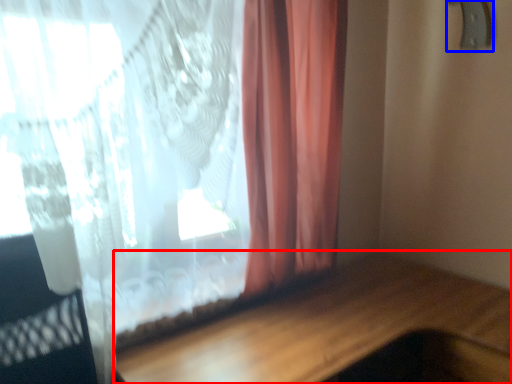
Question: Which object is closer to the camera taking this photo, table (highlighted by a red box) or door handle (highlighted by a blue box)?

Choices:
 (A) table
 (B) door handle

Answer: (A)